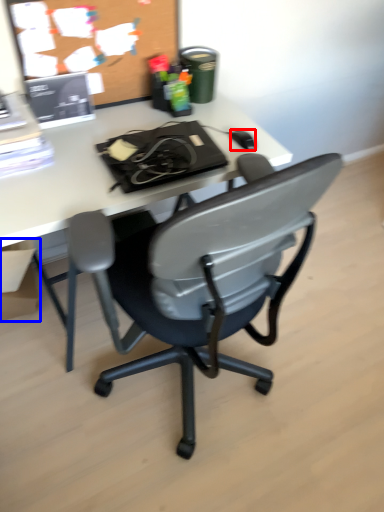
Question: Among these objects, which one is nearest to the camera, mouse (highlighted by a red box) or box (highlighted by a blue box)?

Choices:
 (A) mouse
 (B) box

Answer: (A)